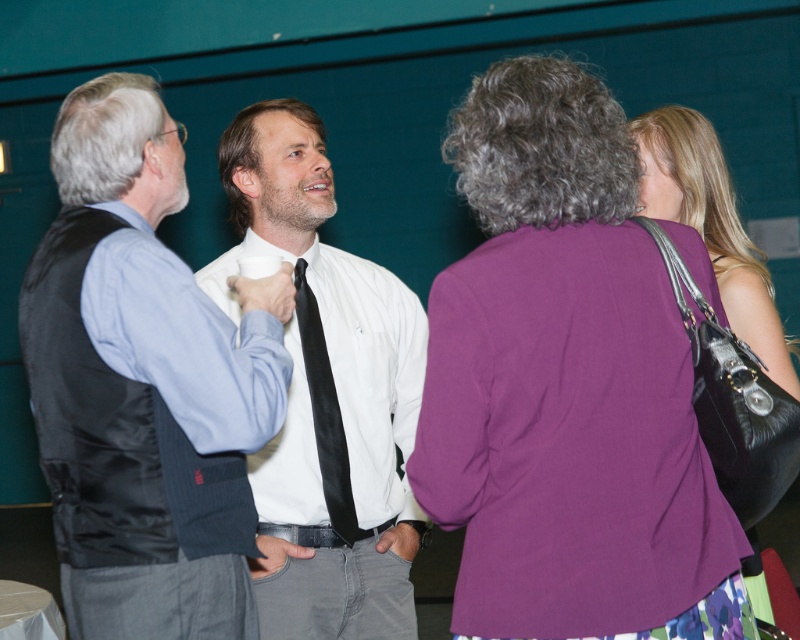
You are standing in the room and want to take a photo of both the point at [656,172] and the point at [318,449]. Which point should you focus on first to ensure both are in focus?

You should focus on the point at [656,172] first because it is closer to you than the point at [318,449], ensuring both will be in focus when using the camera.

You are standing at the origin point of the image coordinate system and want to know what object is located at the coordinates point (326, 396). Please identify the object at that specific location.

The object at point (326, 396) is the white glossy shirt at center.

You are organizing a formal event and need to ensure that the matte black vest at left and the black silk tie at center are visible to all attendees. Considering their positions, which one is more to the left?

The matte black vest at left is positioned on the left side of black silk tie at center, so it is more to the left.